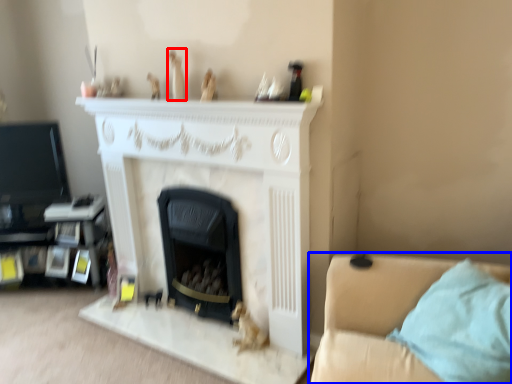
Question: Which object is further to the camera taking this photo, toy (highlighted by a red box) or studio couch (highlighted by a blue box)?

Choices:
 (A) toy
 (B) studio couch

Answer: (A)